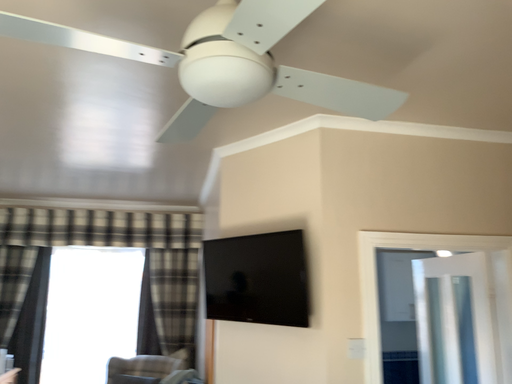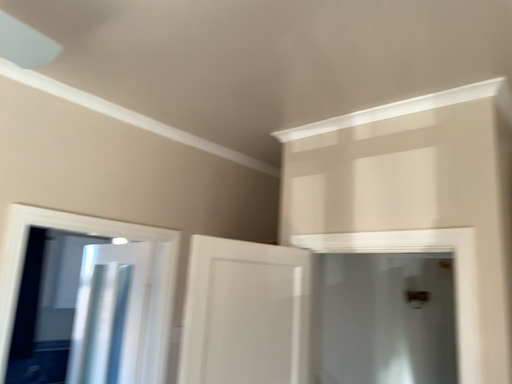
Question: Which way did the camera rotate in the video?

Choices:
 (A) rotated right
 (B) rotated left

Answer: (A)